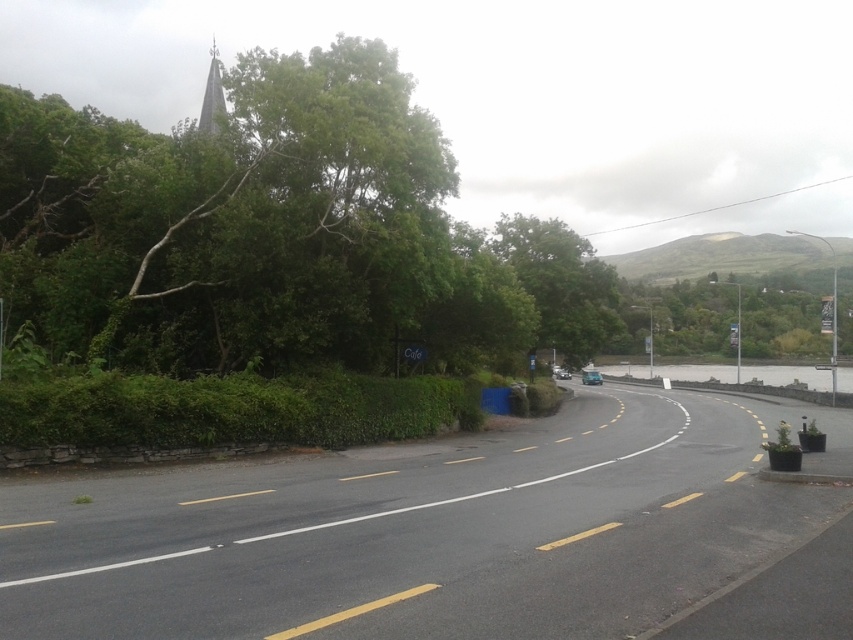
Is green leafy tree at upper left to the left of green leafy hedge at lower left from the viewer's perspective?

Yes, green leafy tree at upper left is to the left of green leafy hedge at lower left.

Can you confirm if green leafy tree at upper left is shorter than green leafy hedge at lower left?

Incorrect, green leafy tree at upper left's height does not fall short of green leafy hedge at lower left's.

Does point (102, 323) come behind point (50, 442)?

Yes, it is.

You are a GUI agent. You are given a task and a screenshot of the screen. Output one action in this format:
    pyautogui.click(x=<x>, y=<y>)
    Task: Click on the green leafy tree at upper left
    
    Given the screenshot: What is the action you would take?
    pyautogui.click(x=277, y=230)